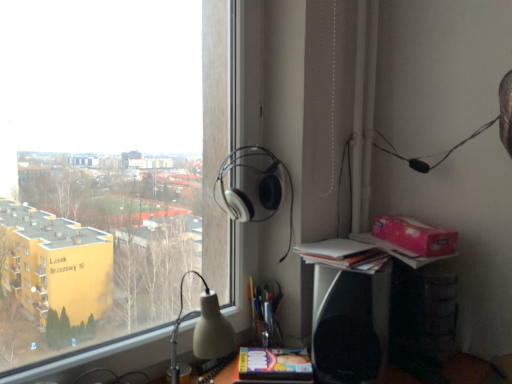
Question: Considering the positions of white matte headphones at upper center and white paper stack at right in the image, is white matte headphones at upper center taller or shorter than white paper stack at right?

Choices:
 (A) tall
 (B) short

Answer: (A)

Question: Based on their positions, is white matte headphones at upper center located to the left or right of white paper stack at right?

Choices:
 (A) left
 (B) right

Answer: (A)

Question: Which is farther from the transparent glass window at upper left?

Choices:
 (A) white matte headphones at upper center
 (B) black plastic speaker at lower right
 (C) matte yellow paperback book at lower center
 (D) pink cardboard box at upper right
 (E) white paper stack at right

Answer: (D)

Question: Estimate the real-world distances between objects in this image. Which object is farther from the pink cardboard box at upper right?

Choices:
 (A) black plastic speaker at lower right
 (B) matte yellow paperback book at lower center
 (C) transparent glass window at upper left
 (D) white paper stack at right
 (E) white matte headphones at upper center

Answer: (C)